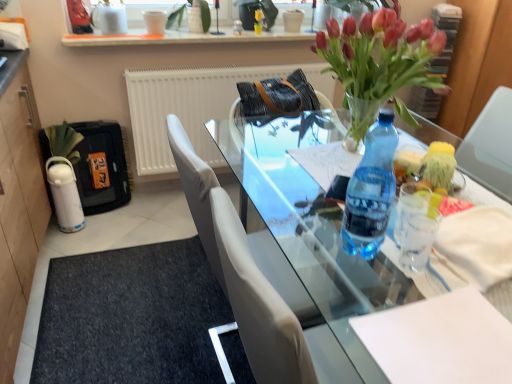
This screenshot has height=384, width=512. Identify the location of free space to the right of transparent glass cup at center. (455, 265).